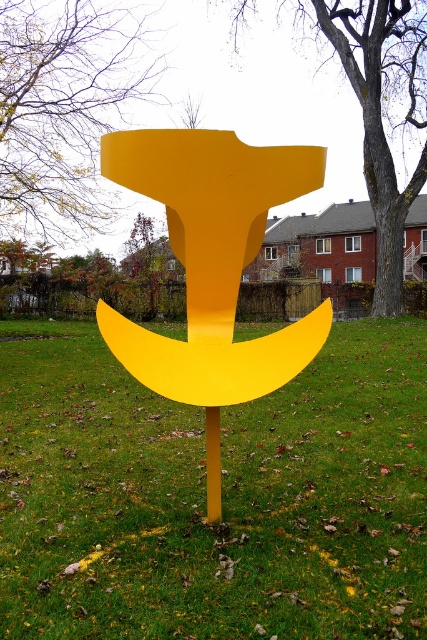
Question: Which point is closer to the camera taking this photo?

Choices:
 (A) (213, 492)
 (B) (377, 76)

Answer: (A)

Question: Can you confirm if smooth bark tree at upper left is positioned to the left of smooth bark tree at center?

Choices:
 (A) no
 (B) yes

Answer: (B)

Question: Which of the following is the farthest from the observer?

Choices:
 (A) yellow matte pole at center
 (B) smooth bark tree at upper left
 (C) matte yellow anchor at center
 (D) green grass at center

Answer: (B)

Question: Does green grass at center appear over smooth bark tree at upper left?

Choices:
 (A) no
 (B) yes

Answer: (A)

Question: Which object appears farthest from the camera in this image?

Choices:
 (A) smooth bark tree at center
 (B) matte yellow anchor at center
 (C) yellow matte pole at center

Answer: (A)

Question: Is green grass at center behind smooth bark tree at upper left?

Choices:
 (A) yes
 (B) no

Answer: (B)